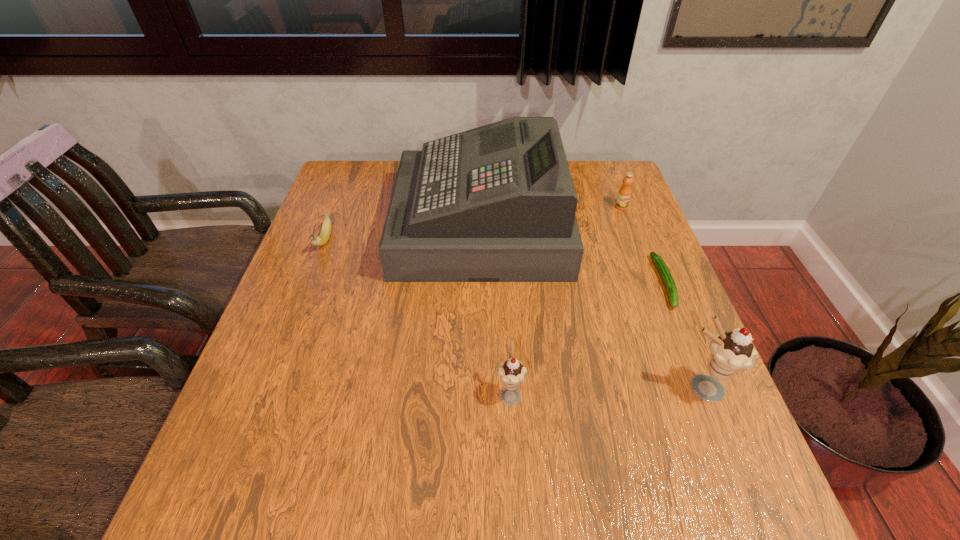
Locate an element on the screen. The height and width of the screenshot is (540, 960). icecream located in the right edge section of the desktop is located at coordinates (730, 352).

I want to click on orange juice that is at the right edge, so click(x=624, y=194).

This screenshot has height=540, width=960. Find the location of `zucchini at the right edge`. zucchini at the right edge is located at coordinates (669, 283).

This screenshot has height=540, width=960. In order to click on object positioned at the far right corner in this screenshot , I will do `click(624, 194)`.

Where is `object that is at the near right corner`? The width and height of the screenshot is (960, 540). object that is at the near right corner is located at coordinates (730, 352).

Locate an element on the screen. This screenshot has height=540, width=960. free location at the far edge is located at coordinates (575, 181).

You are a GUI agent. You are given a task and a screenshot of the screen. Output one action in this format:
    pyautogui.click(x=<x>, y=<y>)
    Task: Click on the vacant space at the near edge of the desktop
    
    Given the screenshot: What is the action you would take?
    pyautogui.click(x=593, y=413)

Locate an element on the screen. The image size is (960, 540). free region at the left edge is located at coordinates (349, 205).

Locate an element on the screen. This screenshot has height=540, width=960. vacant space at the right edge is located at coordinates (631, 293).

Where is `vacant point at the far right corner`? Image resolution: width=960 pixels, height=540 pixels. vacant point at the far right corner is located at coordinates (589, 163).